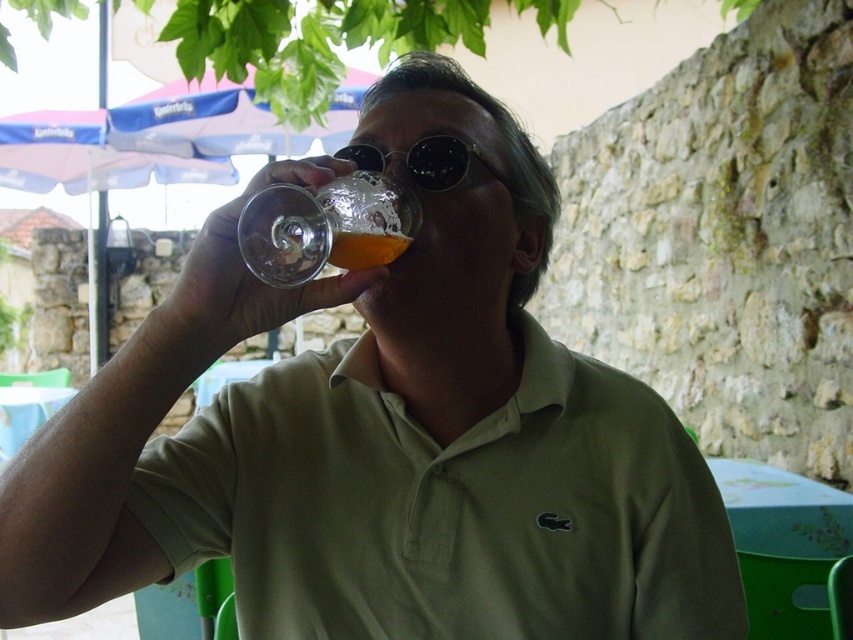
Question: Can you confirm if green cotton polo shirt at center is smaller than sunglasses at center?

Choices:
 (A) no
 (B) yes

Answer: (A)

Question: Which point appears closest to the camera in this image?

Choices:
 (A) (368, 168)
 (B) (554, 417)

Answer: (A)

Question: Which point appears farthest from the camera in this image?

Choices:
 (A) (515, 196)
 (B) (314, 515)

Answer: (A)

Question: Among these objects, which one is farthest from the camera?

Choices:
 (A) sunglasses at center
 (B) green cotton polo shirt at center
 (C) translucent glass at upper center

Answer: (B)

Question: Is translucent glass at upper center to the right of sunglasses at center from the viewer's perspective?

Choices:
 (A) yes
 (B) no

Answer: (B)

Question: Can you confirm if green cotton polo shirt at center is smaller than sunglasses at center?

Choices:
 (A) no
 (B) yes

Answer: (A)